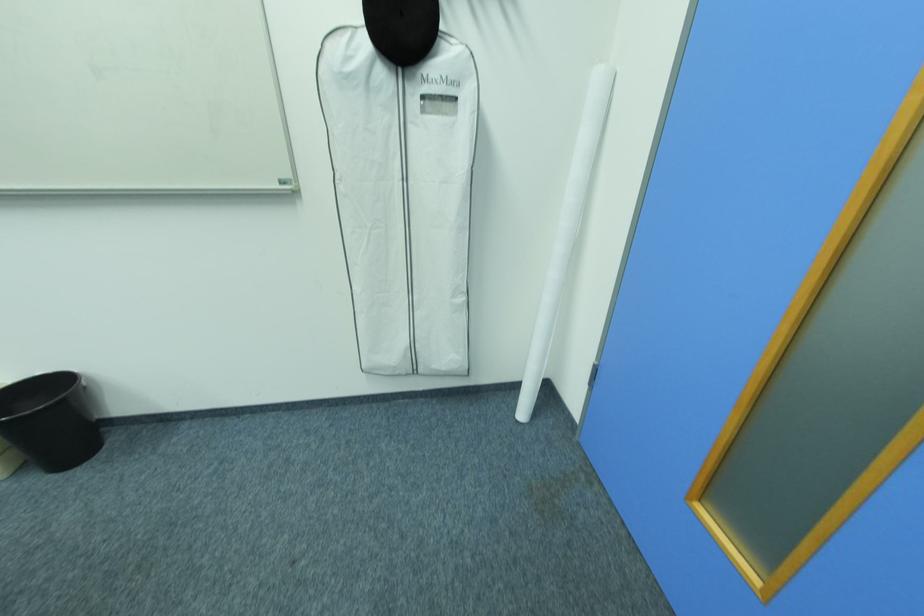
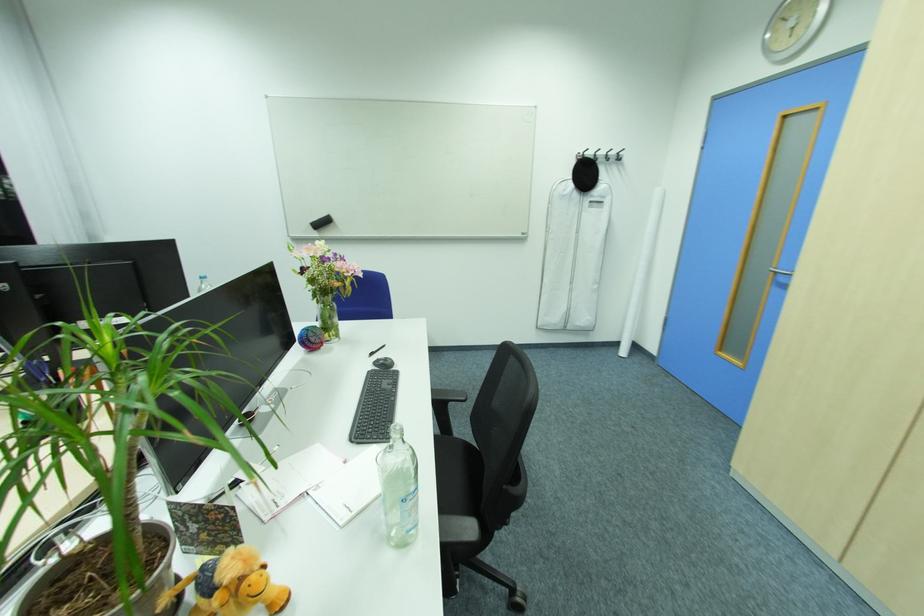
In a continuous first-person perspective shot, in which direction is the camera moving?

The movement direction of the cameraman is left, backward.